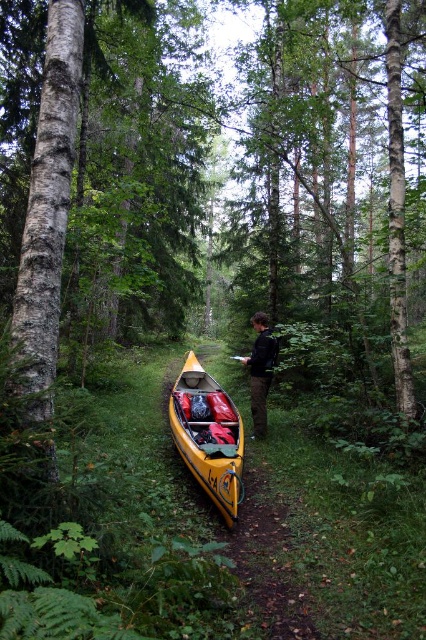
Question: Which point is closer to the camera?

Choices:
 (A) yellow matte canoe at center
 (B) wooden paddle at center

Answer: (A)

Question: Is black fabric person at center bigger than wooden paddle at center?

Choices:
 (A) no
 (B) yes

Answer: (B)

Question: Is yellow matte canoe at center to the left of black fabric person at center from the viewer's perspective?

Choices:
 (A) yes
 (B) no

Answer: (A)

Question: Among these objects, which one is nearest to the camera?

Choices:
 (A) yellow matte canoe at center
 (B) black fabric person at center

Answer: (A)

Question: Observing the image, what is the correct spatial positioning of yellow matte canoe at center in reference to wooden paddle at center?

Choices:
 (A) right
 (B) left

Answer: (B)

Question: Which object appears farthest from the camera in this image?

Choices:
 (A) wooden paddle at center
 (B) yellow matte canoe at center
 (C) black fabric person at center

Answer: (C)